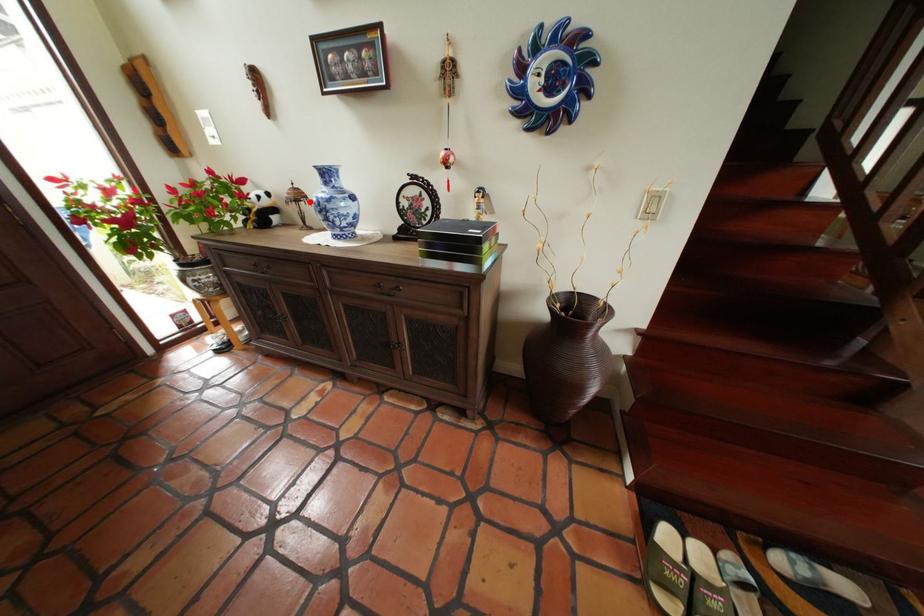
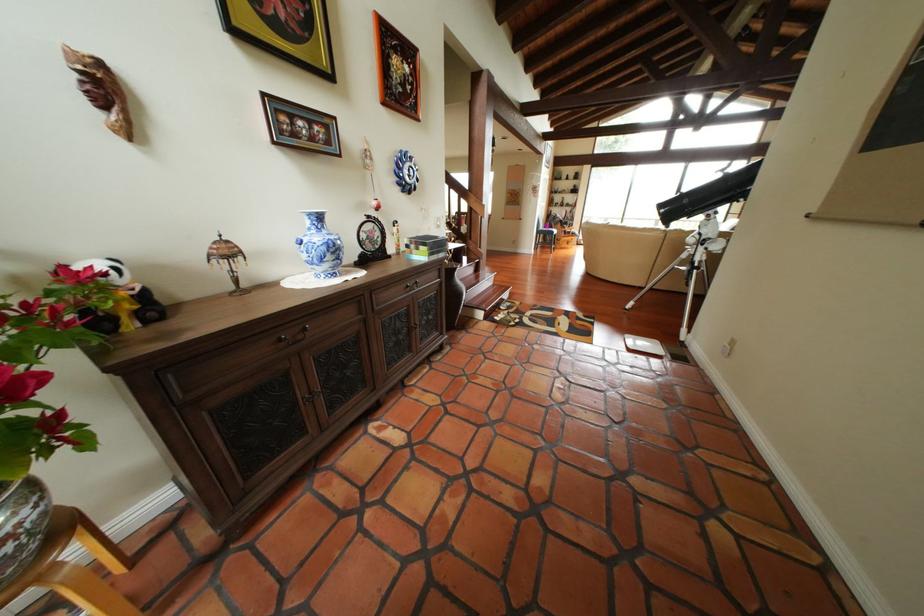
Where in the second image is the point corresponding to the highlighted location from the first image?

(241, 257)